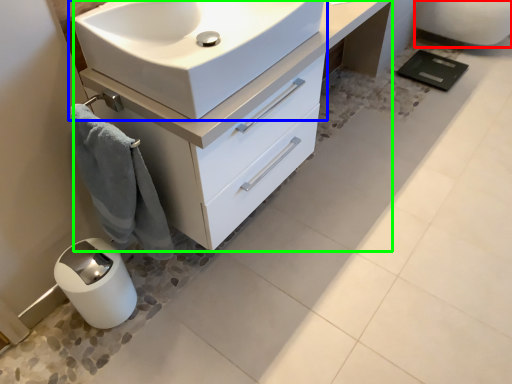
Question: Which object is the closest to the porcelain (highlighted by a red box)? Choose among these: sink (highlighted by a blue box) or bathroom cabinet (highlighted by a green box).

Choices:
 (A) sink
 (B) bathroom cabinet

Answer: (B)